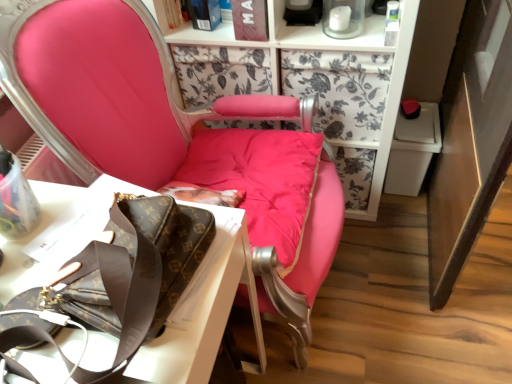
This screenshot has width=512, height=384. I want to click on vacant area on top of white paper at upper left (from a real-world perspective), so click(x=62, y=251).